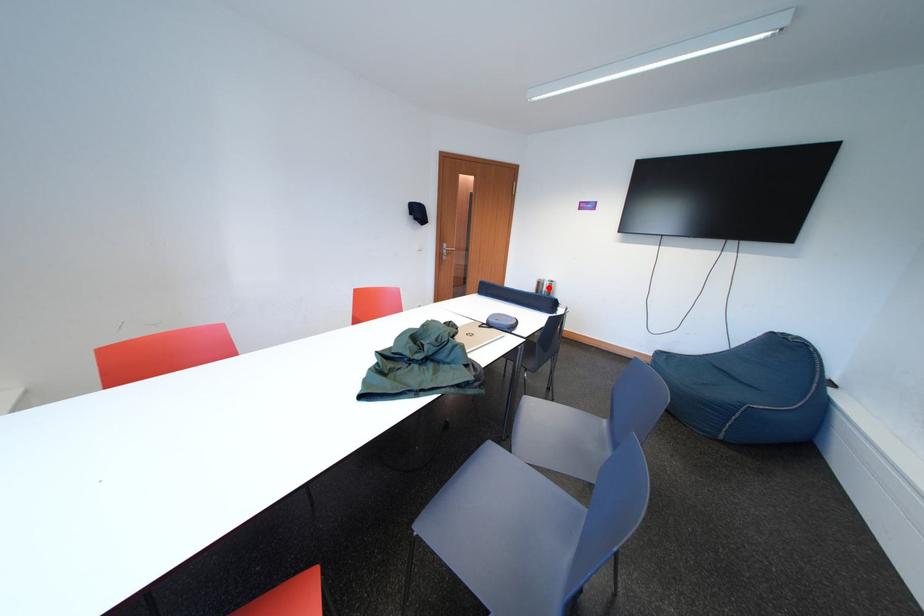
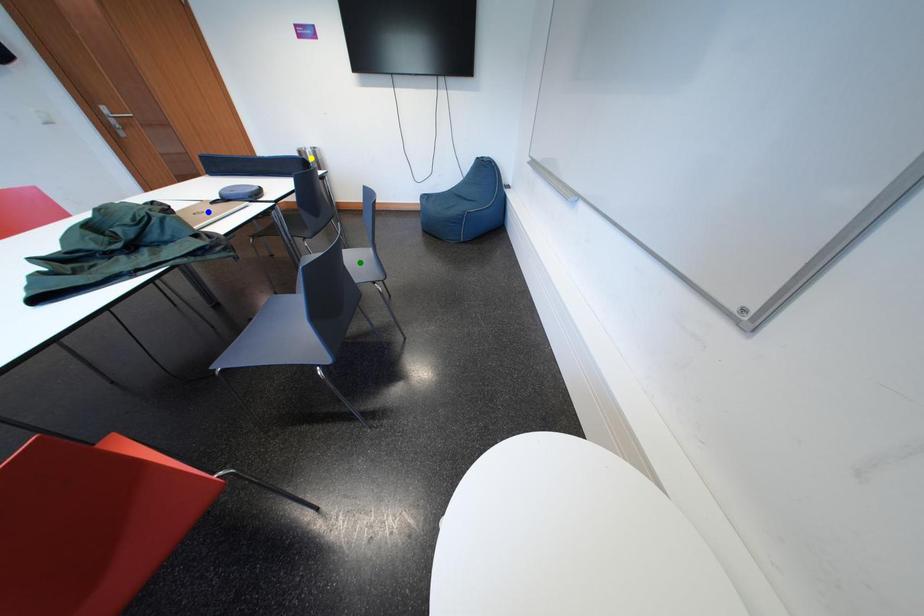
Question: I am providing you with two images of the same scene from different viewpoints. A red point is marked on the first image. You are given multiple points on the second image. Can you choose the point in image 2 that corresponds to the point in image 1?

Choices:
 (A) blue point
 (B) green point
 (C) yellow point

Answer: (C)